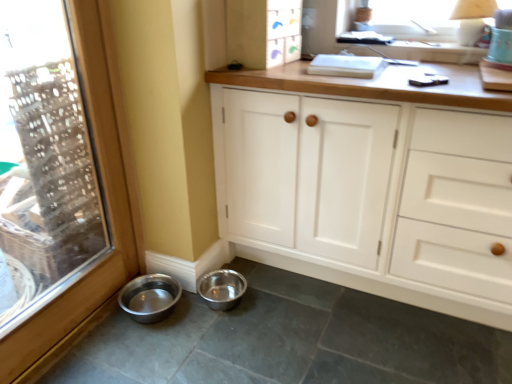
Where is `vacant region in front of metallic silver bowl at lower left, acting as the second basin starting from the left`? This screenshot has height=384, width=512. vacant region in front of metallic silver bowl at lower left, acting as the second basin starting from the left is located at coordinates (216, 324).